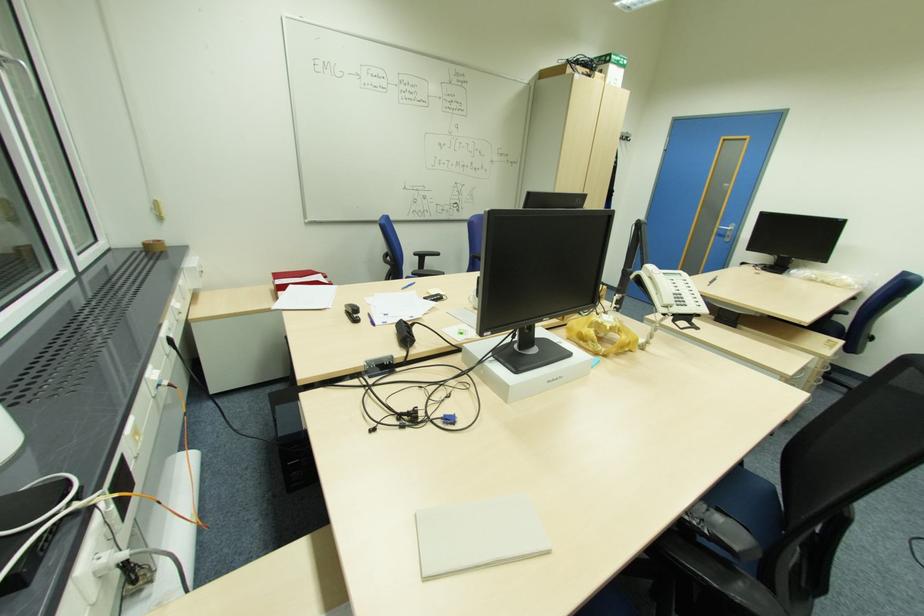
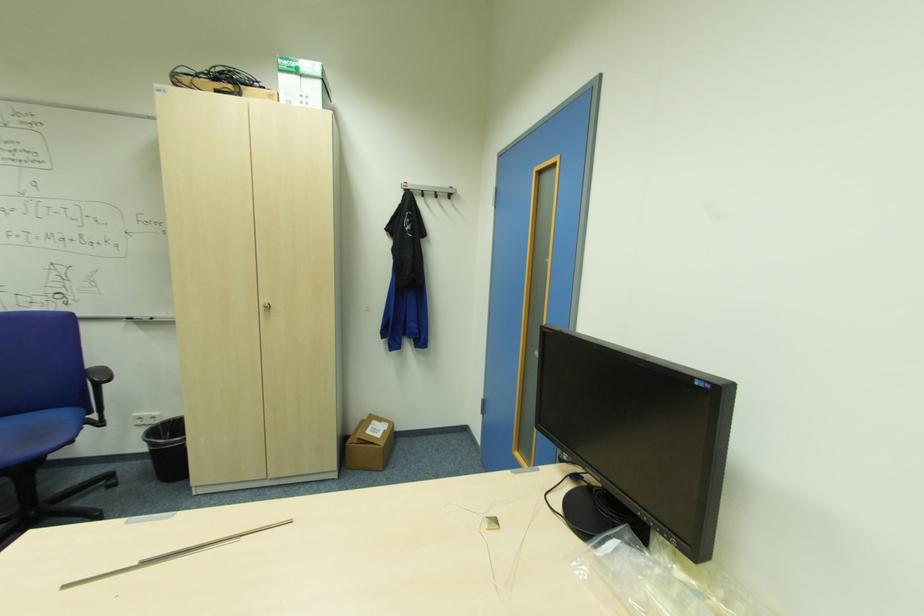
The point at (711, 285) is marked in the first image. Where is the corresponding point in the second image?

(63, 589)